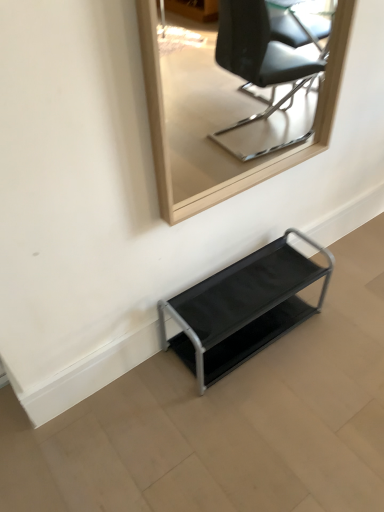
Question: Is the depth of metallic gray shelf at lower center less than that of wooden frame mirror at upper center?

Choices:
 (A) yes
 (B) no

Answer: (B)

Question: From a real-world perspective, is metallic gray shelf at lower center on top of wooden frame mirror at upper center?

Choices:
 (A) no
 (B) yes

Answer: (A)

Question: From a real-world perspective, is metallic gray shelf at lower center physically below wooden frame mirror at upper center?

Choices:
 (A) yes
 (B) no

Answer: (A)

Question: Is metallic gray shelf at lower center positioned behind wooden frame mirror at upper center?

Choices:
 (A) yes
 (B) no

Answer: (A)

Question: From the image's perspective, would you say metallic gray shelf at lower center is shown under wooden frame mirror at upper center?

Choices:
 (A) no
 (B) yes

Answer: (B)

Question: Is metallic gray shelf at lower center facing away from wooden frame mirror at upper center?

Choices:
 (A) yes
 (B) no

Answer: (B)

Question: Does wooden frame mirror at upper center lie in front of metallic gray shelf at lower center?

Choices:
 (A) yes
 (B) no

Answer: (A)

Question: From the image's perspective, is wooden frame mirror at upper center located above metallic gray shelf at lower center?

Choices:
 (A) yes
 (B) no

Answer: (A)

Question: Is wooden frame mirror at upper center to the right of metallic gray shelf at lower center from the viewer's perspective?

Choices:
 (A) yes
 (B) no

Answer: (B)

Question: Can you confirm if wooden frame mirror at upper center is taller than metallic gray shelf at lower center?

Choices:
 (A) yes
 (B) no

Answer: (A)

Question: Would you say metallic gray shelf at lower center is part of wooden frame mirror at upper center's contents?

Choices:
 (A) yes
 (B) no

Answer: (B)

Question: Does wooden frame mirror at upper center turn towards metallic gray shelf at lower center?

Choices:
 (A) yes
 (B) no

Answer: (B)

Question: From the image's perspective, is metallic gray shelf at lower center located above or below wooden frame mirror at upper center?

Choices:
 (A) above
 (B) below

Answer: (B)